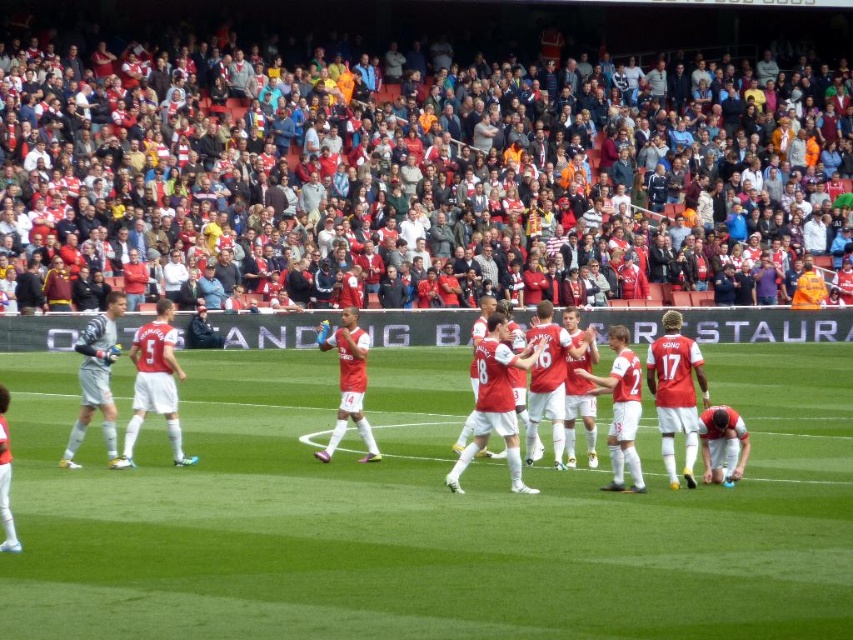
You are a photographer at the football stadium and want to capture a photo that includes both the red fabric crowd at upper center and the green grass football field at center. Based on their positions, which object should appear on the left side of the photo?

The green grass football field at center should appear on the left side of the photo because the red fabric crowd at upper center is to the right of it.

You are a photographer standing at the center of the football field. You want to take a photo of the two points on the field marked as point 1 at (817, 456) and point 2 at (109, 419). Which point will appear closer to the bottom of the photo?

Point 2 at (109, 419) will appear closer to the bottom of the photo because it is closer to the camera than point 1 at (817, 456).